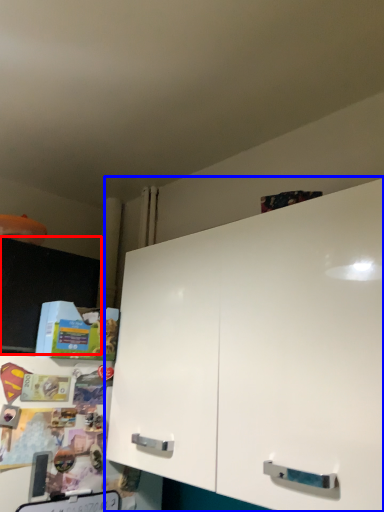
Question: Which of the following is the closest to the observer, cabinetry (highlighted by a red box) or cabinetry (highlighted by a blue box)?

Choices:
 (A) cabinetry
 (B) cabinetry

Answer: (B)